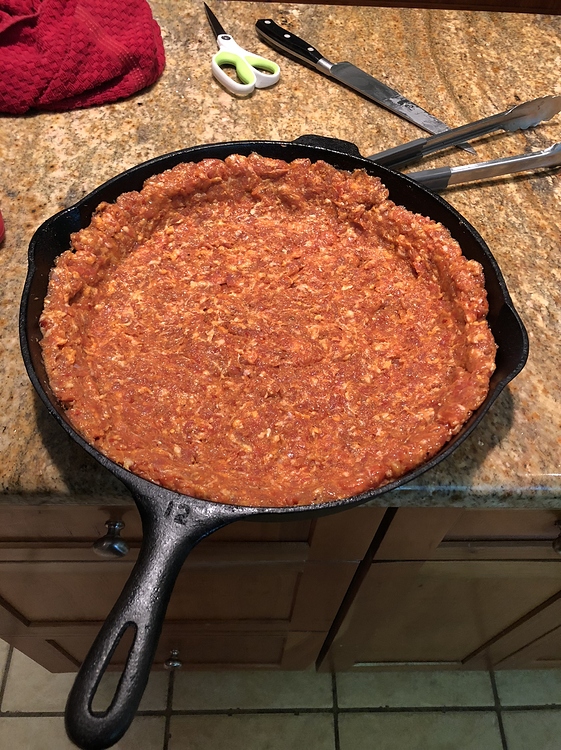
The width and height of the screenshot is (561, 750). Identify the location of tile line. (234, 706).